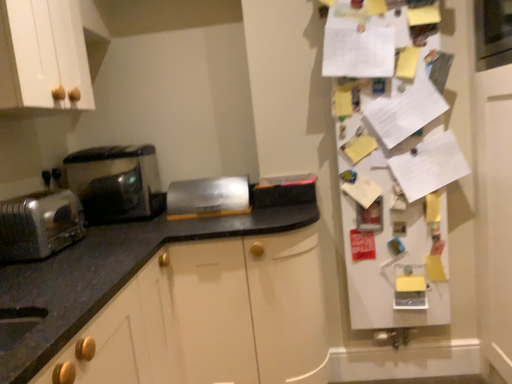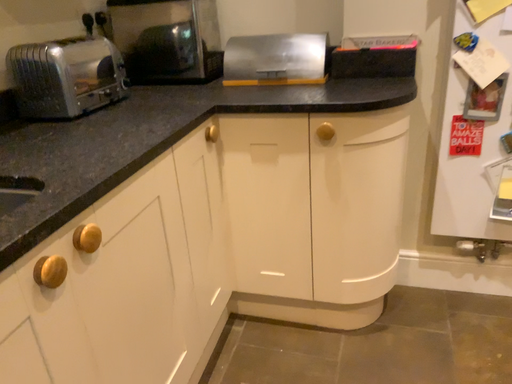
Question: Which way did the camera rotate in the video?

Choices:
 (A) rotated upward
 (B) rotated downward

Answer: (B)